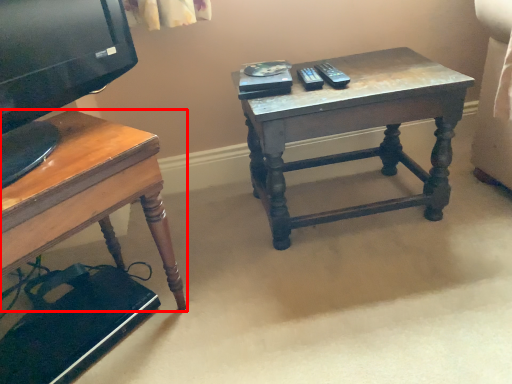
Question: From the image, what is the correct spatial relationship of desk (annotated by the red box) in relation to table?

Choices:
 (A) right
 (B) left

Answer: (B)